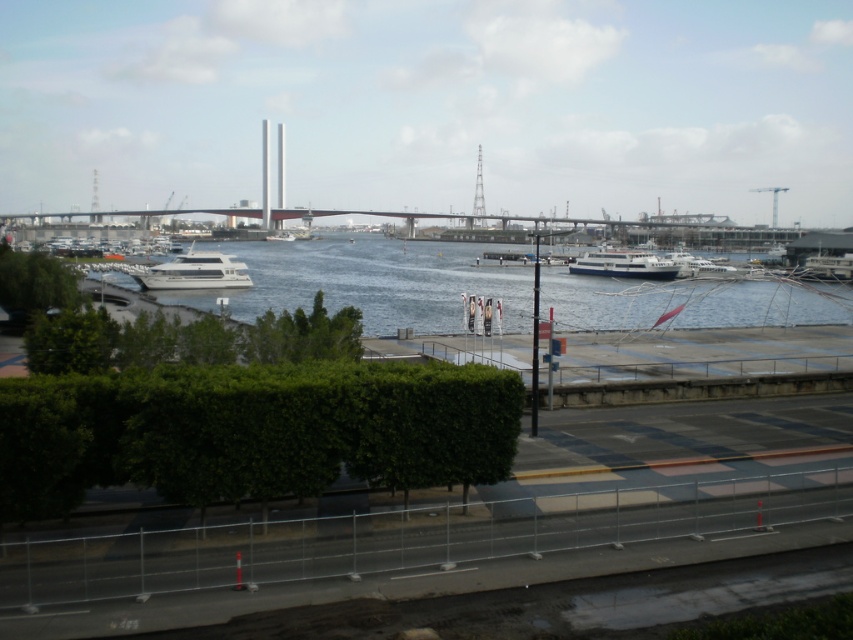
You are a photographer planning to capture the waterfront scene. You want to ensure both the concrete bridge at center and the white glossy ferry at center are clearly visible in your shot. Based on their sizes, which object should you focus on first to ensure it stands out more in the composition?

The concrete bridge at center is much taller than the white glossy ferry at center, so focusing on the concrete bridge at center first will ensure it stands out more in the composition.

Please provide the 2D coordinates of the green leafy hedge at center in the image. The coordinates should be in the format of a tuple with two decimal numbers separated by a comma, enclosed in parentheses. For example, the format would be like this for an example coordinate pair, but you must use the actual values from the provided description. Do not add any additional text or explanation in your answer. Just the coordinate tuple.

The 2D coordinates of the green leafy hedge at center are at point (253, 432). So the answer is the tuple with those numbers in parentheses.